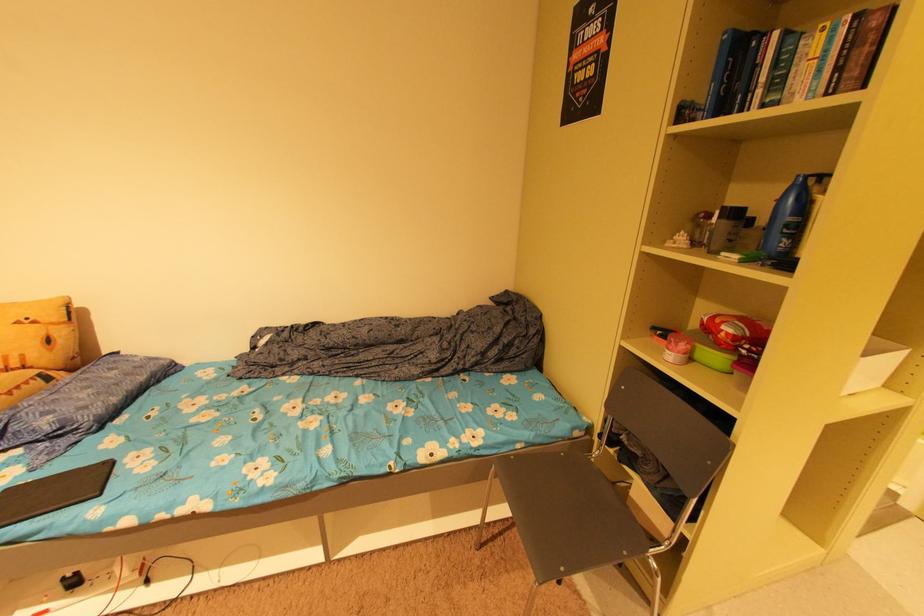
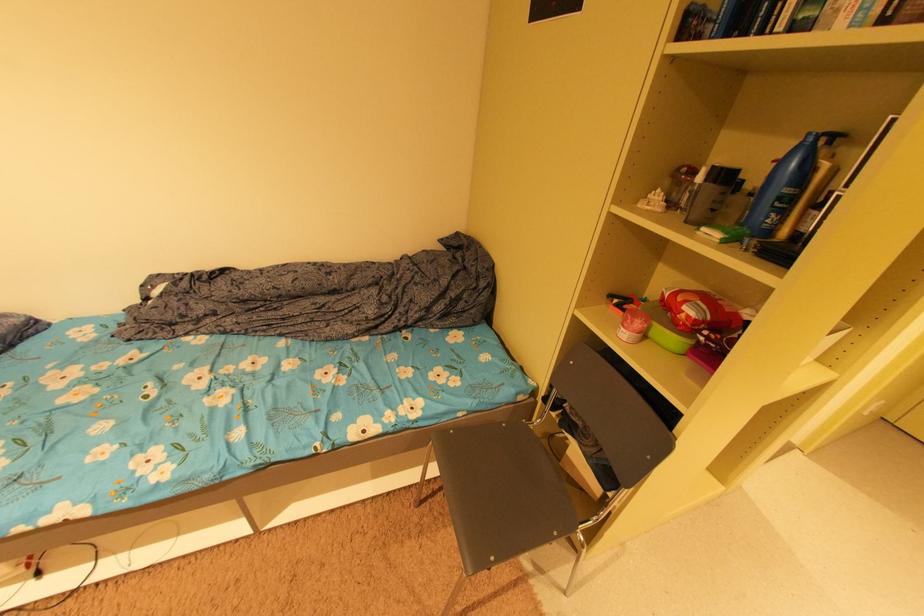
The images are taken continuously from a first-person perspective. In which direction are you moving?

The cameraman walked toward right, forward.